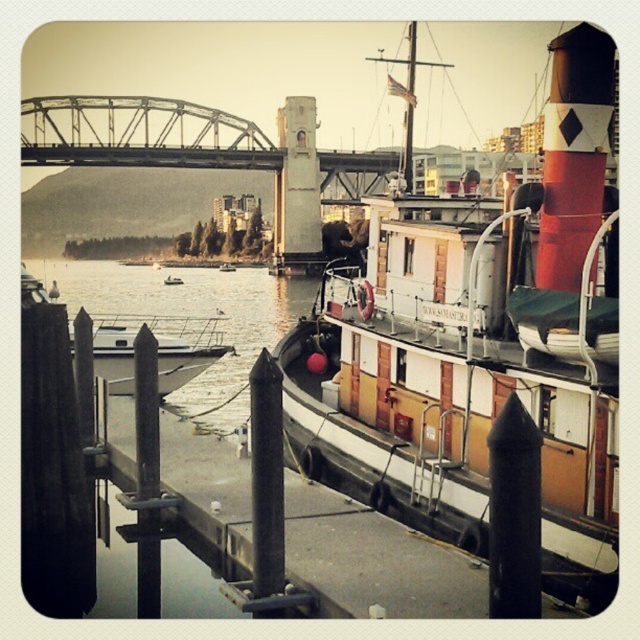
Question: Among these points, which one is nearest to the camera?

Choices:
 (A) (500, 227)
 (B) (38, 268)

Answer: (A)

Question: Which object is the closest to the white glossy boat at center?

Choices:
 (A) clear water at dock center
 (B) wooden cabin cruiser at center

Answer: (B)

Question: Does smooth concrete dock at center have a lesser width compared to clear water at dock center?

Choices:
 (A) no
 (B) yes

Answer: (B)

Question: Which object is the farthest from the wooden cabin cruiser at center?

Choices:
 (A) smooth concrete dock at center
 (B) white glossy boat at center
 (C) clear water at dock center

Answer: (C)

Question: Can you confirm if smooth concrete dock at center is positioned above white glossy boat at center?

Choices:
 (A) no
 (B) yes

Answer: (A)

Question: Is clear water at dock center smaller than white glossy boat at center?

Choices:
 (A) yes
 (B) no

Answer: (B)